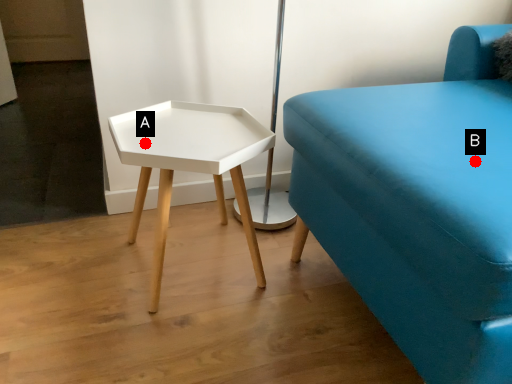
Question: Two points are circled on the image, labeled by A and B beside each circle. Which point is closer to the camera?

Choices:
 (A) A is closer
 (B) B is closer

Answer: (B)